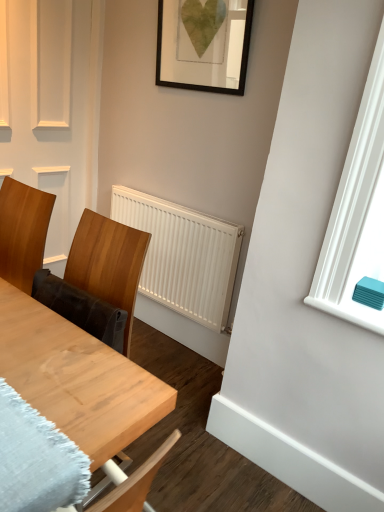
What is the approximate width of wooden table at center?

The width of wooden table at center is 54.25 centimeters.

Image resolution: width=384 pixels, height=512 pixels. I want to click on wooden table at center, so click(x=77, y=379).

Locate an element on the screen. white matte radiator at center is located at coordinates [183, 256].

Could white matte radiator at center be considered to be inside wooden chair at left?

No, white matte radiator at center is located outside of wooden chair at left.

From a real-world perspective, is wooden chair at left positioned above or below white matte radiator at center?

wooden chair at left is situated higher than white matte radiator at center in the real world.

Is wooden chair at left far from white matte radiator at center?

wooden chair at left is actually quite close to white matte radiator at center.

Which is more to the right, black matte picture frame at upper center or white matte radiator at center?

Positioned to the right is black matte picture frame at upper center.

Is black matte picture frame at upper center oriented away from white matte radiator at center?

No, white matte radiator at center is not at the back of black matte picture frame at upper center.

From a real-world perspective, is black matte picture frame at upper center on wooden table at center?

Yes, from a real-world perspective, black matte picture frame at upper center is on top of wooden table at center.

Considering the sizes of objects black matte picture frame at upper center and wooden table at center in the image provided, who is taller, black matte picture frame at upper center or wooden table at center?

Standing taller between the two is wooden table at center.

Who is smaller, black matte picture frame at upper center or wooden table at center?

Smaller between the two is black matte picture frame at upper center.

Does point (175, 74) lie in front of point (55, 334)?

That is False.

Which of these two, white matte radiator at center or wooden table at center, is bigger?

wooden table at center.

From the image's perspective, which object appears higher, white matte radiator at center or wooden table at center?

white matte radiator at center is shown above in the image.

Is wooden table at center surrounded by white matte radiator at center?

Definitely not — wooden table at center is not inside white matte radiator at center.

Which is closer to the camera, (136, 222) or (67, 433)?

Clearly, point (136, 222) is more distant from the camera than point (67, 433).

Is wooden table at center positioned beyond the bounds of black matte picture frame at upper center?

Yes, wooden table at center is located beyond the bounds of black matte picture frame at upper center.

Is wooden table at center taller or shorter than black matte picture frame at upper center?

wooden table at center is taller than black matte picture frame at upper center.

From the image's perspective, is wooden table at center over black matte picture frame at upper center?

No, from the image's perspective, wooden table at center is not above black matte picture frame at upper center.

Is point (102, 452) closer to viewer compared to point (206, 55)?

Yes.

Between wooden chair at left and black matte picture frame at upper center, which one appears on the left side from the viewer's perspective?

wooden chair at left.

Which is correct: wooden chair at left is inside black matte picture frame at upper center, or outside of it?

wooden chair at left cannot be found inside black matte picture frame at upper center.

Is wooden chair at left wider than black matte picture frame at upper center?

Indeed, wooden chair at left has a greater width compared to black matte picture frame at upper center.

From a real-world perspective, is wooden chair at left located higher than black matte picture frame at upper center?

Incorrect, from a real-world perspective, wooden chair at left is lower than black matte picture frame at upper center.

Does point (213, 8) come farther from viewer compared to point (0, 258)?

Yes, point (213, 8) is farther from viewer.

Would you say black matte picture frame at upper center is to the left or to the right of wooden chair at left in the picture?

black matte picture frame at upper center is to the right of wooden chair at left.

Is wooden chair at left a part of black matte picture frame at upper center?

That's incorrect, wooden chair at left is not inside black matte picture frame at upper center.

Looking at this image, can you tell me how much black matte picture frame at upper center and wooden chair at left differ in facing direction?

The angle between the facing direction of black matte picture frame at upper center and the facing direction of wooden chair at left is 1.96 degrees.

Image resolution: width=384 pixels, height=512 pixels. Identify the location of chair that is above the white matte radiator at center (from the image's perspective). pyautogui.click(x=23, y=232).

I want to click on picture frame on the right side of white matte radiator at center, so click(x=203, y=44).

Based on their spatial positions, is black matte picture frame at upper center or wooden table at center closer to wooden chair at left?

wooden table at center lies closer to wooden chair at left than the other object.

From the image, which object appears to be farther from black matte picture frame at upper center, white matte radiator at center or wooden table at center?

wooden table at center.

Which object lies further to the anchor point wooden chair at left, wooden table at center or black matte picture frame at upper center?

The object further to wooden chair at left is black matte picture frame at upper center.

Estimate the real-world distances between objects in this image. Which object is further from wooden table at center, black matte picture frame at upper center or wooden chair at left?

black matte picture frame at upper center lies further to wooden table at center than the other object.

Based on their spatial positions, is wooden table at center or black matte picture frame at upper center closer to white matte radiator at center?

Among the two, black matte picture frame at upper center is located nearer to white matte radiator at center.

From the picture: Considering their positions, is black matte picture frame at upper center positioned closer to wooden table at center than white matte radiator at center?

white matte radiator at center.

From the image, which object appears to be nearer to wooden table at center, wooden chair at left or black matte picture frame at upper center?

wooden chair at left is closer to wooden table at center.

Considering their positions, is white matte radiator at center positioned further to wooden chair at left than wooden table at center?

white matte radiator at center.

Image resolution: width=384 pixels, height=512 pixels. In order to click on picture frame between wooden table at center and white matte radiator at center from front to back in this screenshot , I will do `click(203, 44)`.

You are a GUI agent. You are given a task and a screenshot of the screen. Output one action in this format:
    pyautogui.click(x=<x>, y=<y>)
    Task: Click on the chair between black matte picture frame at upper center and white matte radiator at center from top to bottom
    
    Given the screenshot: What is the action you would take?
    pyautogui.click(x=23, y=232)

In order to click on chair between black matte picture frame at upper center and wooden table at center vertically in this screenshot , I will do `click(23, 232)`.

At what (x,y) coordinates should I click in order to perform the action: click on chair between wooden table at center and white matte radiator at center along the z-axis. Please return your answer as a coordinate pair (x, y). This screenshot has width=384, height=512. Looking at the image, I should click on (23, 232).